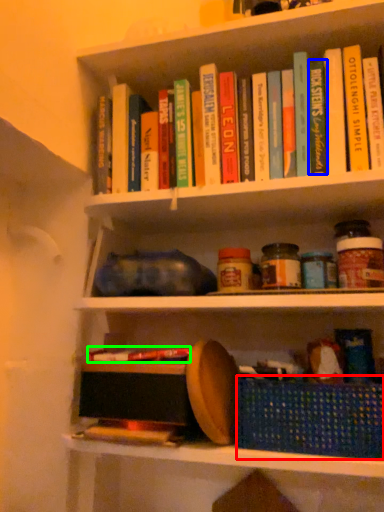
Question: Considering the real-world distances, which object is farthest from basket (highlighted by a red box)? paperback book (highlighted by a blue box) or book (highlighted by a green box)?

Choices:
 (A) paperback book
 (B) book

Answer: (A)